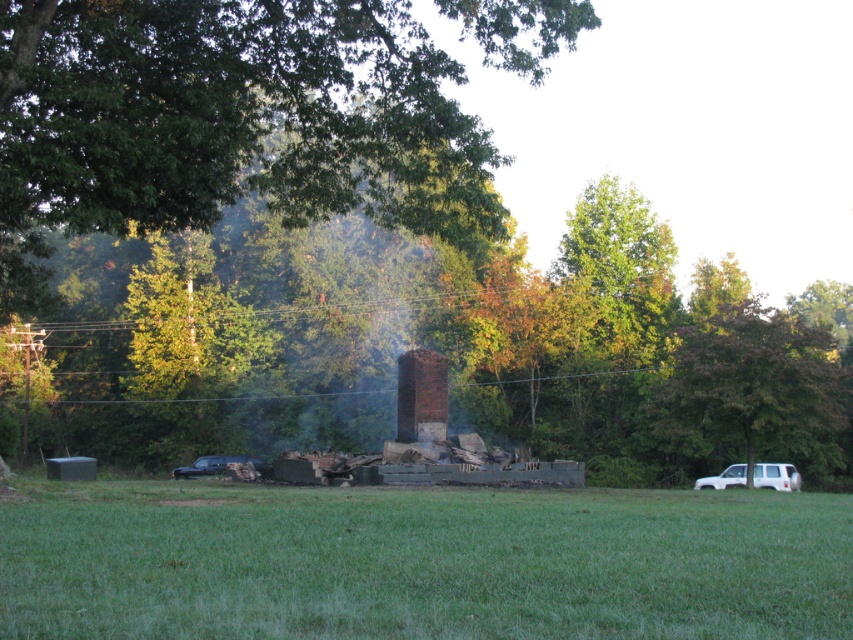
You are standing in the rural field and want to take a photo of the green leafy tree at upper center and the black matte car at lower left. Which object should you focus on first if you want both to be in sharp focus?

The green leafy tree at upper center is closer to the viewer than the black matte car at lower left, so you should focus on the green leafy tree at upper center first to ensure both are in focus.